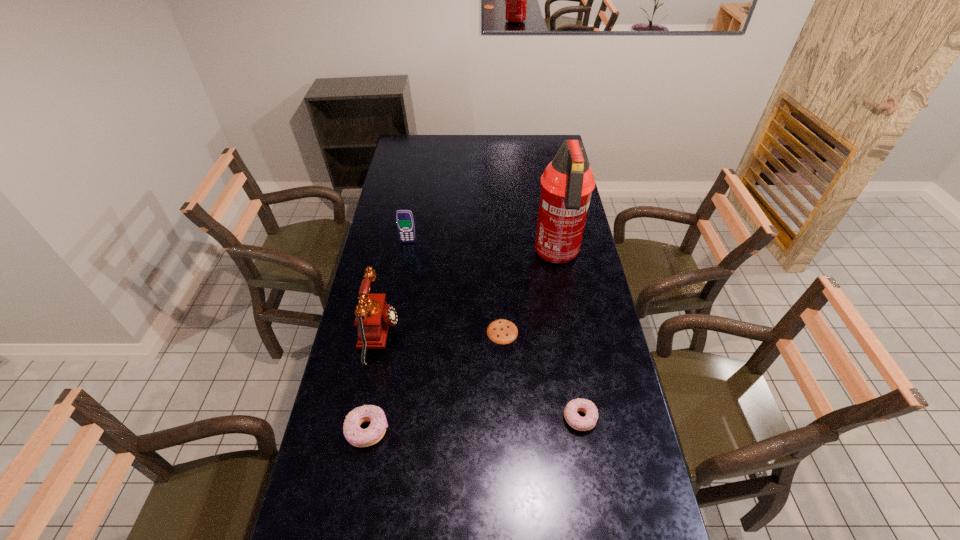
Where is `free region that satisfies the following two spatial constraints: 1. on the dial of the fifth shortest object; 2. on the back side of the shorter doughnut`? The width and height of the screenshot is (960, 540). free region that satisfies the following two spatial constraints: 1. on the dial of the fifth shortest object; 2. on the back side of the shorter doughnut is located at coordinates (363, 418).

This screenshot has width=960, height=540. Identify the location of vacant area that satisfies the following two spatial constraints: 1. on the trigger side of the fire extinguisher; 2. on the dial of the fifth shortest object. (571, 335).